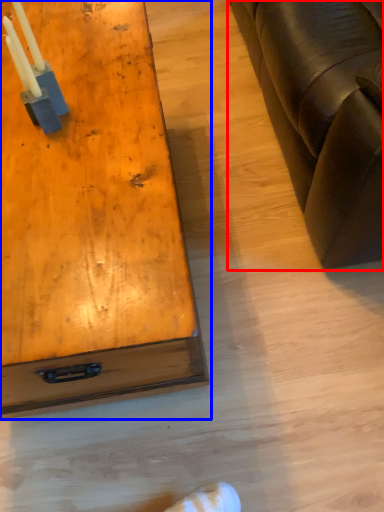
Question: Which object is further to the camera taking this photo, studio couch (highlighted by a red box) or table (highlighted by a blue box)?

Choices:
 (A) studio couch
 (B) table

Answer: (B)